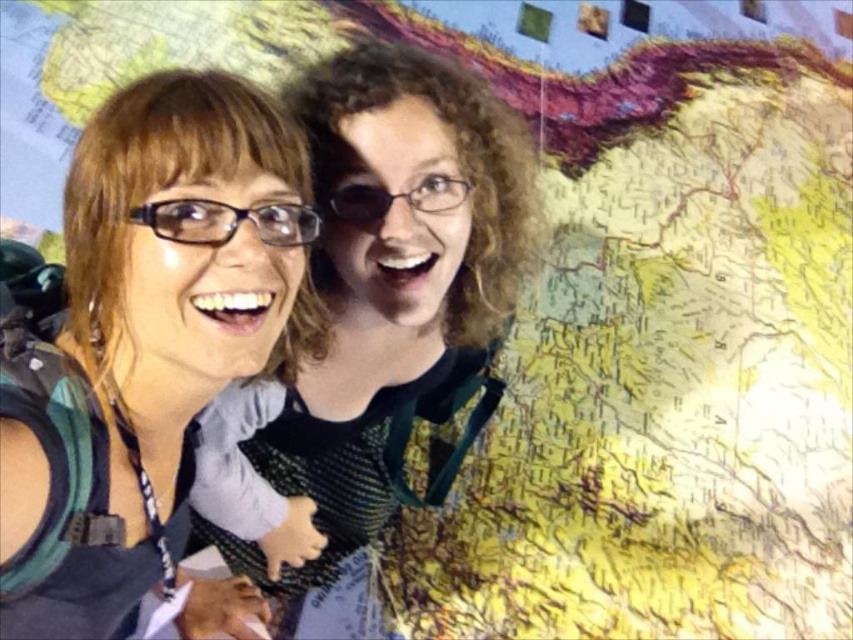
Can you confirm if matte black glasses at left is shorter than matte black glasses at center?

Indeed, matte black glasses at left has a lesser height compared to matte black glasses at center.

Can you confirm if matte black glasses at left is bigger than matte black glasses at center?

No.

Is point (68, 596) positioned before point (422, 406)?

Yes, point (68, 596) is in front of point (422, 406).

The height and width of the screenshot is (640, 853). Identify the location of matte black glasses at left. (144, 342).